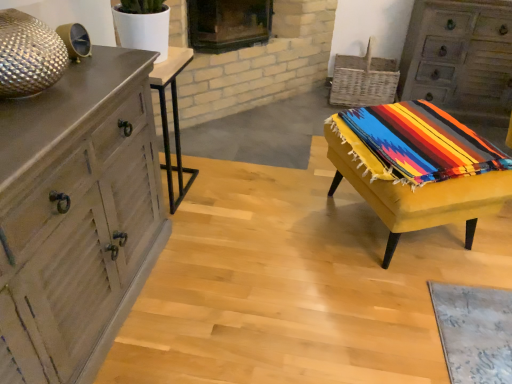
Question: Does rustic wood chest of drawers at upper right, the first chest of drawers when ordered from top to bottom, have a smaller size compared to wooden table at left, which is the first table in left-to-right order?

Choices:
 (A) yes
 (B) no

Answer: (B)

Question: From a real-world perspective, is rustic wood chest of drawers at upper right, acting as the 2th chest of drawers starting from the bottom, under wooden table at left, placed as the 2th table when sorted from right to left?

Choices:
 (A) yes
 (B) no

Answer: (B)

Question: Is the depth of rustic wood chest of drawers at upper right, the second chest of drawers when ordered from front to back, less than that of wooden table at left, placed as the 2th table when sorted from right to left?

Choices:
 (A) yes
 (B) no

Answer: (B)

Question: Is the surface of rustic wood chest of drawers at upper right, placed as the 2th chest of drawers when sorted from left to right, in direct contact with wooden table at left, placed as the 2th table when sorted from right to left?

Choices:
 (A) no
 (B) yes

Answer: (A)

Question: Is rustic wood chest of drawers at upper right, the first chest of drawers when ordered from top to bottom, positioned beyond the bounds of wooden table at left, which is the first table in left-to-right order?

Choices:
 (A) no
 (B) yes

Answer: (B)

Question: Is rustic wood chest of drawers at upper right, the first chest of drawers when ordered from top to bottom, positioned behind wooden table at left, placed as the 2th table when sorted from right to left?

Choices:
 (A) no
 (B) yes

Answer: (B)

Question: Can we say wooden chest of drawers at left, the second chest of drawers in the top-to-bottom sequence, lies outside black glass fireplace at upper center?

Choices:
 (A) no
 (B) yes

Answer: (B)

Question: From the image's perspective, does wooden chest of drawers at left, the second chest of drawers in the top-to-bottom sequence, appear lower than black glass fireplace at upper center?

Choices:
 (A) yes
 (B) no

Answer: (A)

Question: Is wooden chest of drawers at left, which is counted as the 2th chest of drawers, starting from the back, shorter than black glass fireplace at upper center?

Choices:
 (A) yes
 (B) no

Answer: (B)

Question: From a real-world perspective, is wooden chest of drawers at left, placed as the 1th chest of drawers when sorted from front to back, physically below black glass fireplace at upper center?

Choices:
 (A) yes
 (B) no

Answer: (A)

Question: Is wooden chest of drawers at left, marked as the 1th chest of drawers in a left-to-right arrangement, oriented towards black glass fireplace at upper center?

Choices:
 (A) no
 (B) yes

Answer: (A)

Question: Does wooden chest of drawers at left, marked as the 1th chest of drawers in a left-to-right arrangement, have a greater height compared to black glass fireplace at upper center?

Choices:
 (A) no
 (B) yes

Answer: (B)

Question: Is yellow fabric-covered stool at right, which is the 2th table from left to right, shorter than wooden chest of drawers at left, which is the first chest of drawers in bottom-to-top order?

Choices:
 (A) yes
 (B) no

Answer: (A)